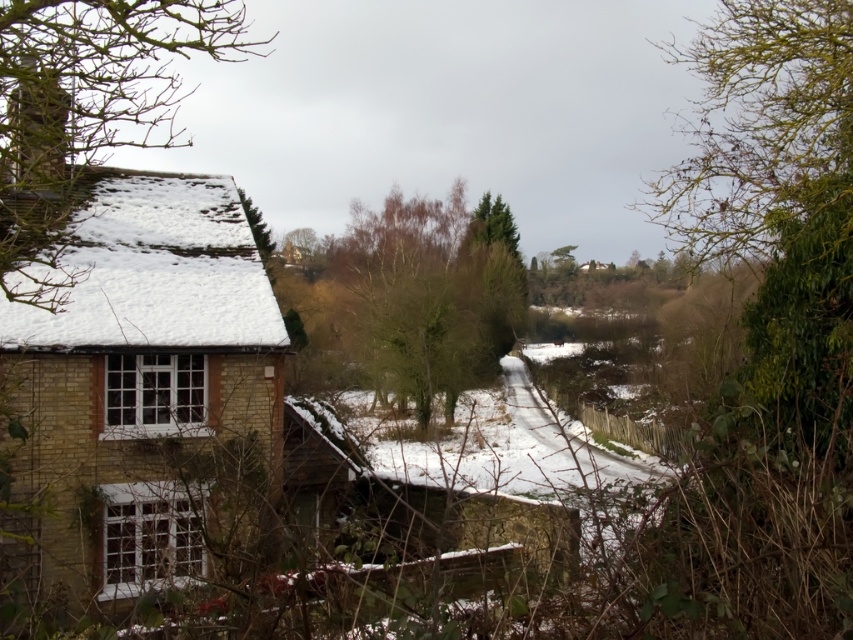
You are standing at the center of the image and want to take a photo of the white fluffy roof at left. In which direction should you point your camera to capture it?

The white fluffy roof at left is located at point (155, 273), which means it is positioned to the left and slightly above the center of the image. To capture it, you should point your camera to the left and slightly upwards.

You are an artist planning to paint the winter scene. You need to decide which part of the scene to focus on first based on their sizes. Which object should you start with, the bare branches at left or the brown textured tree at center?

You should start with the bare branches at left because its width is larger than the brown textured tree at center.